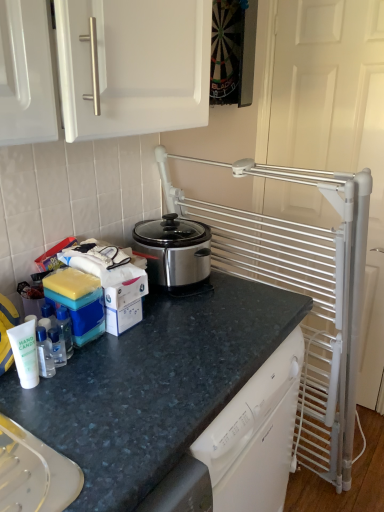
Locate an element on the screen. This screenshot has height=512, width=384. vacant area in front of clear plastic bottle at left, which is counted as the second bottle, starting from the back is located at coordinates (51, 412).